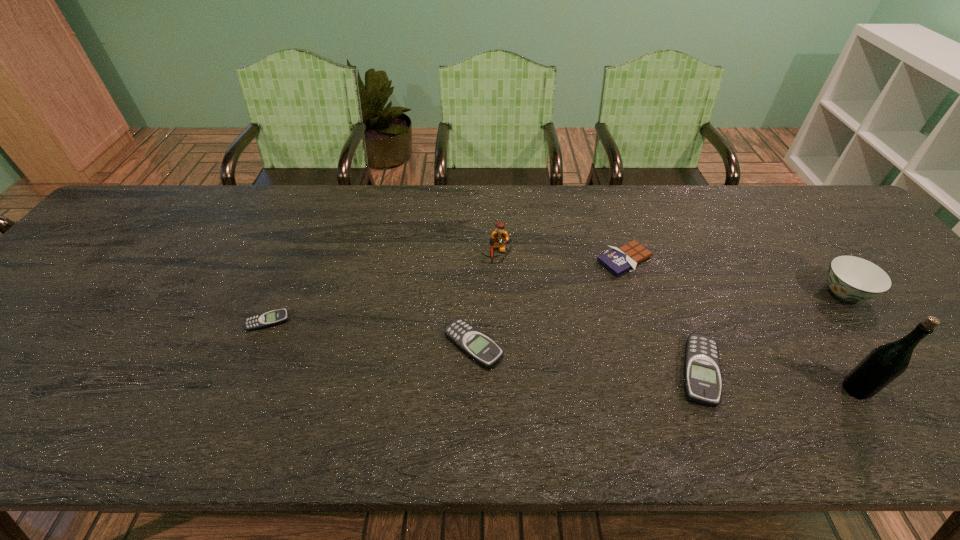
What are the coordinates of `vacant area at the near edge of the desktop` in the screenshot? It's located at (64, 402).

I want to click on vacant space at the left edge, so click(74, 276).

Locate an element on the screen. The width and height of the screenshot is (960, 540). free space between the rightmost beeper and the sixth object from left to right is located at coordinates coord(778,380).

Where is `vacant area between the rightmost object and the second object from right to left`? vacant area between the rightmost object and the second object from right to left is located at coordinates (850, 341).

Where is `empty space between the soup bowl and the shortest object`? empty space between the soup bowl and the shortest object is located at coordinates (556, 307).

Locate an element on the screen. This screenshot has height=540, width=960. vacant area between the beer bottle and the Lego is located at coordinates (676, 322).

You are a GUI agent. You are given a task and a screenshot of the screen. Output one action in this format:
    pyautogui.click(x=<x>, y=<y>)
    Task: Click on the empty location between the leftmost object and the chocolate bar
    The width and height of the screenshot is (960, 540).
    Given the screenshot: What is the action you would take?
    pyautogui.click(x=446, y=291)

Image resolution: width=960 pixels, height=540 pixels. Find the location of `free point between the second beeper from right to left and the rightmost object`. free point between the second beeper from right to left and the rightmost object is located at coordinates (659, 319).

Locate an element on the screen. This screenshot has height=540, width=960. vacant point located between the beer bottle and the shortest object is located at coordinates (562, 355).

The height and width of the screenshot is (540, 960). I want to click on free space that is in between the tallest object and the second beeper from right to left, so click(664, 367).